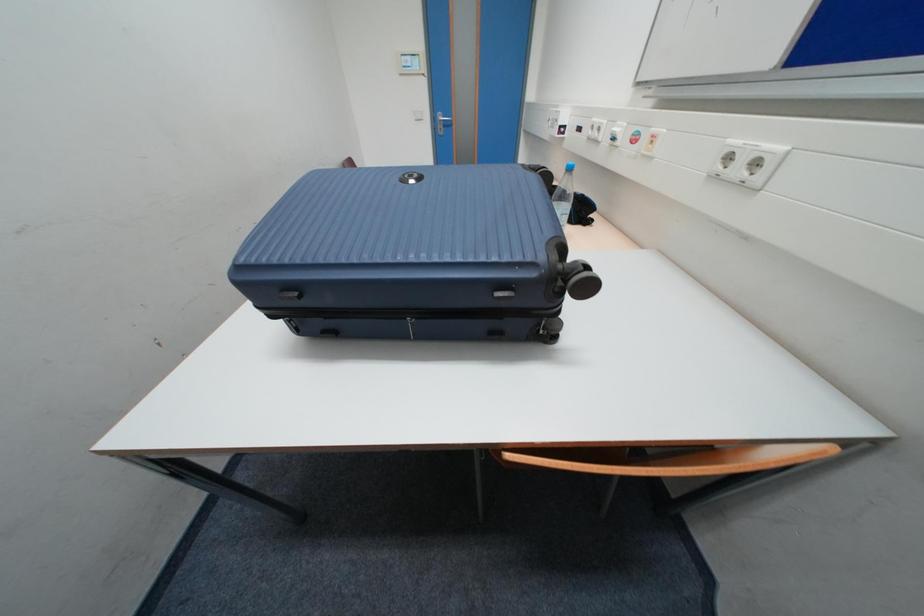
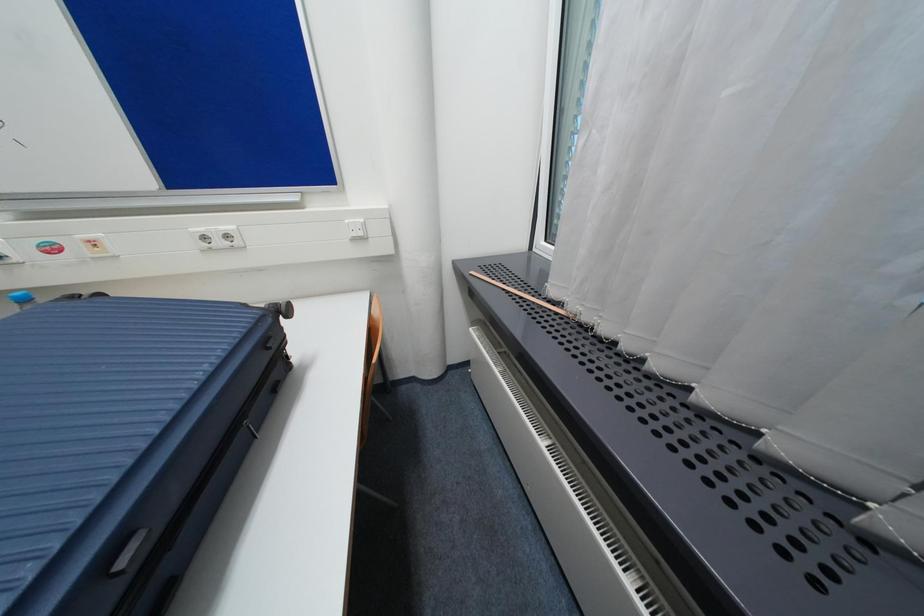
How did the camera likely rotate?

The camera's rotation is toward right-down.